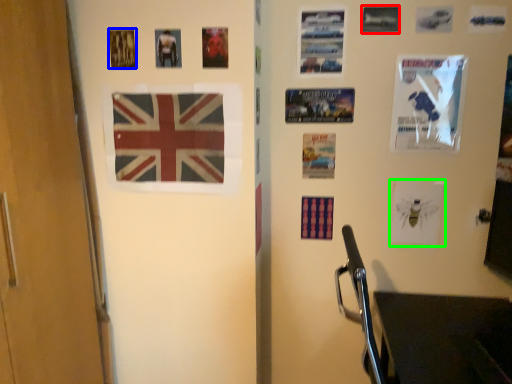
Question: Based on their relative distances, which object is farther from poster page (highlighted by a red box)? Choose from poster page (highlighted by a blue box) and poster page (highlighted by a green box).

Choices:
 (A) poster page
 (B) poster page

Answer: (A)